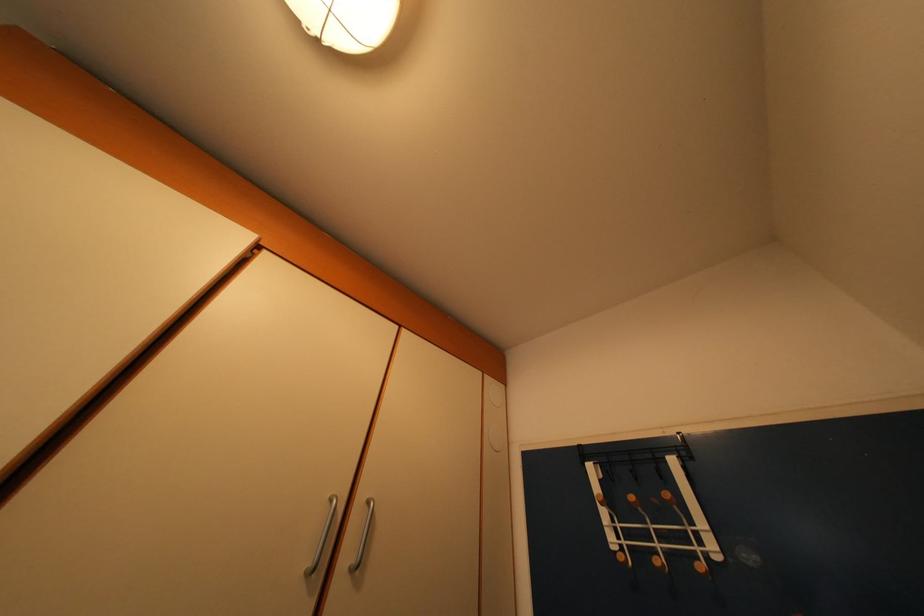
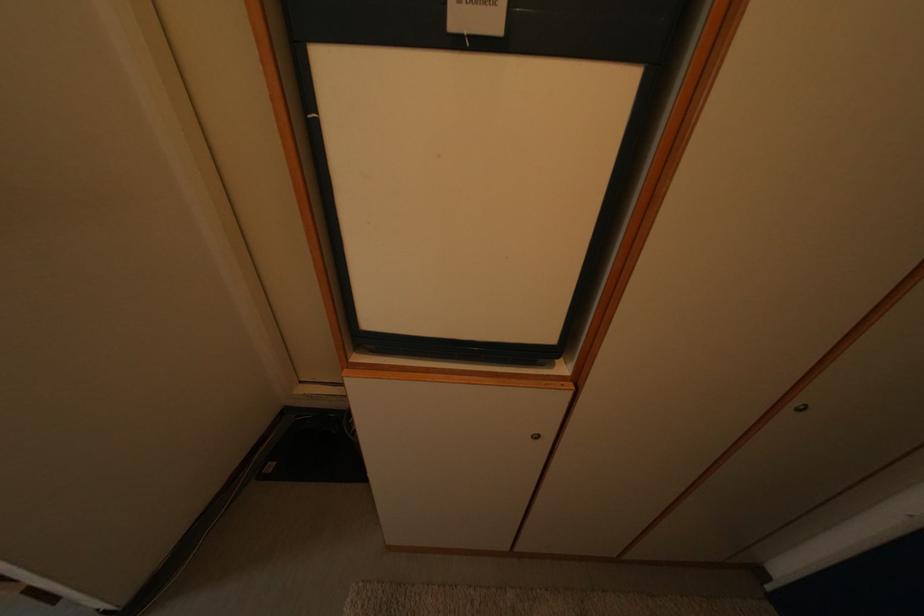
First-person continuous shooting, in which direction is the camera rotating?

The camera rotated toward left-down.